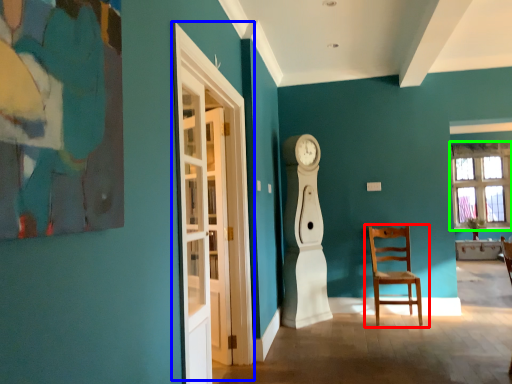
Question: Which is farther away from chair (highlighted by a red box)? glass door (highlighted by a blue box) or window (highlighted by a green box)?

Choices:
 (A) glass door
 (B) window

Answer: (B)